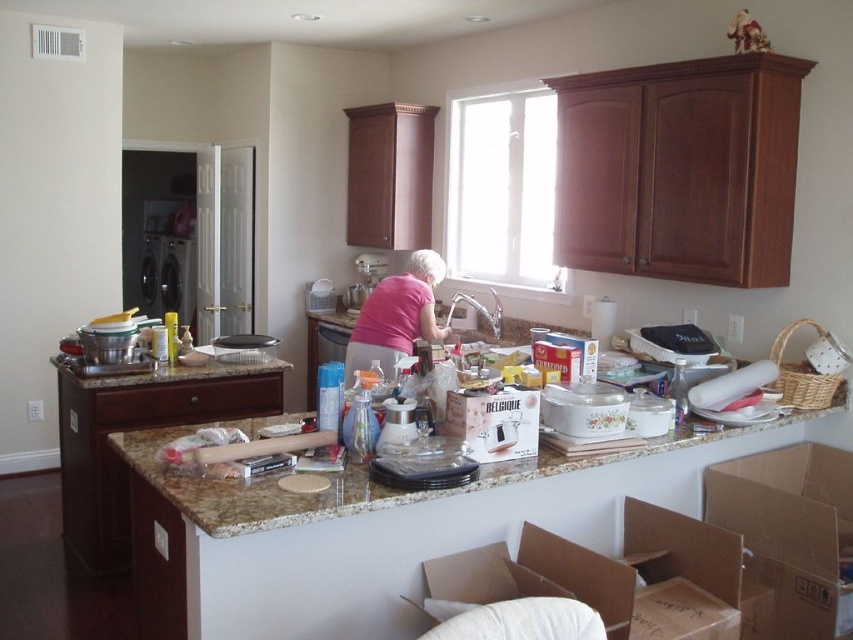
Question: Which of the following is the farthest from the observer?

Choices:
 (A) (775, 579)
 (B) (364, 470)
 (C) (508, 426)
 (D) (396, 307)

Answer: (D)

Question: Which object is the closest to the black plastic dishwasher at left?

Choices:
 (A) pink matte shirt at center
 (B) brown cardboard box at lower right
 (C) granite countertop at center
 (D) matte white box at center

Answer: (A)

Question: Which of the following is the farthest from the observer?

Choices:
 (A) brown cardboard box at lower right
 (B) black plastic dishwasher at left

Answer: (B)

Question: Can you confirm if matte white box at center is bigger than black plastic dishwasher at left?

Choices:
 (A) no
 (B) yes

Answer: (A)

Question: Is granite countertop at center above matte white box at center?

Choices:
 (A) yes
 (B) no

Answer: (B)

Question: Does granite countertop at center appear on the right side of black plastic dishwasher at left?

Choices:
 (A) yes
 (B) no

Answer: (A)